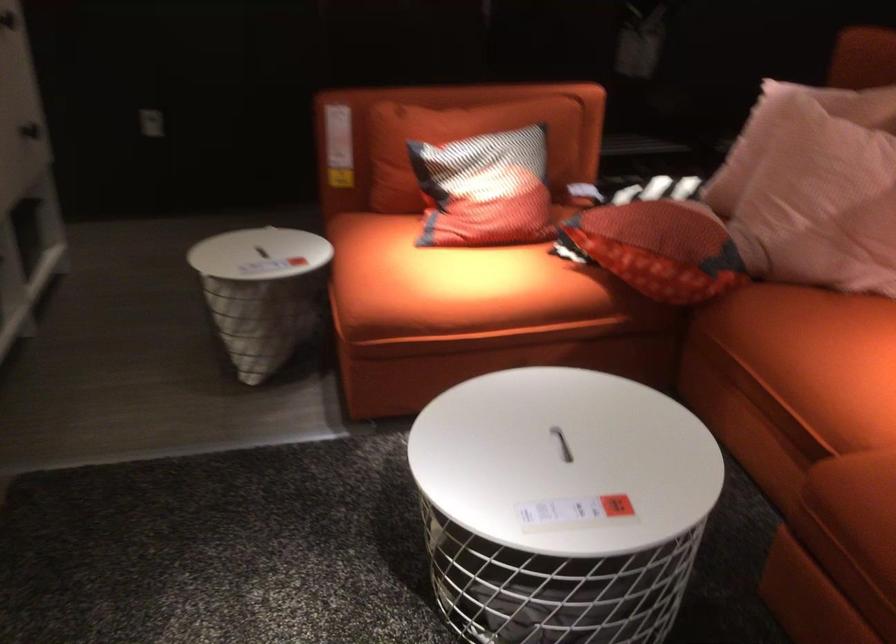
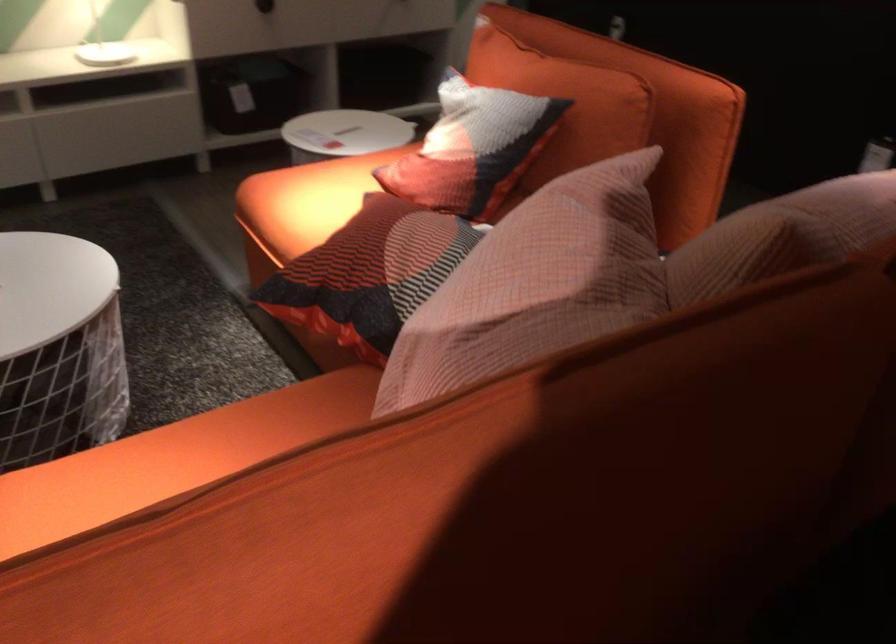
Locate, in the second image, the point that corresponds to (435,285) in the first image.

(306, 200)